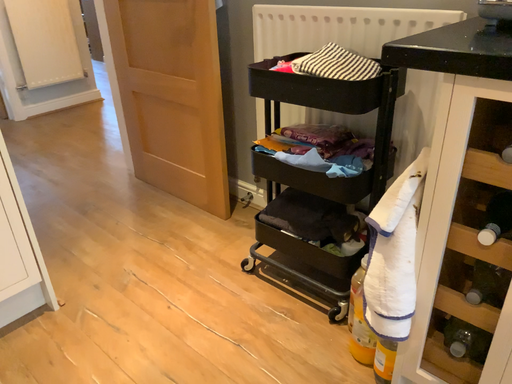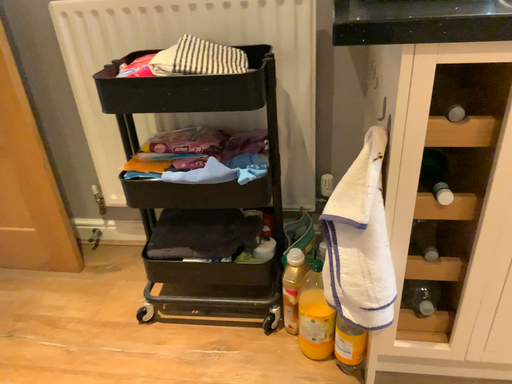
Question: Which way did the camera rotate in the video?

Choices:
 (A) rotated left
 (B) rotated right

Answer: (B)